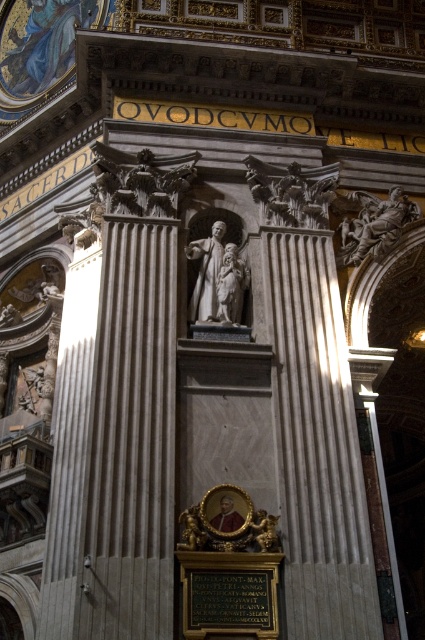
You are an art conservator examining the church interior. You need to move a ladder to access both the white marble statue at center and the polished marble statue at upper right. Which statue should you place the ladder closer to first if you want to start with the one that is positioned more to the left?

The white marble statue at center is to the left of polished marble statue at upper right, so you should place the ladder closer to the white marble statue at center first since it is positioned more to the left.

You are standing in the grand cathedral and want to take a photo of the statue of the saint holding a child. The camera you are using has a focal length of 50mm. If you want to capture the statue in the center of your photo without any distortion, should you position yourself closer or farther from the point at coordinates (x=235, y=282)?

The distance between point (x=235, y=282) and the camera is 41.77 meters. To avoid distortion and center the statue, you should position yourself farther from the point at (x=235, y=282) since a longer distance with a 50mm lens reduces perspective distortion and keeps the statue centered.